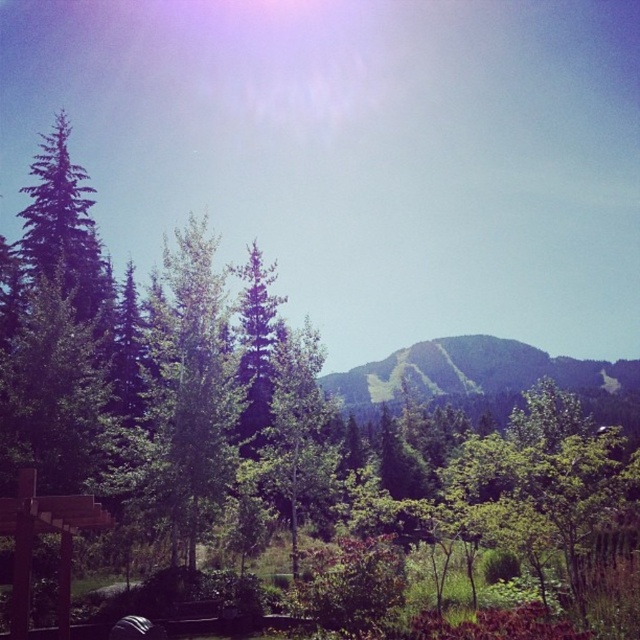
Does green leafy tree at center have a greater height compared to green grassy mountain at center?

Indeed, green leafy tree at center has a greater height compared to green grassy mountain at center.

Does green leafy tree at center have a smaller size compared to green grassy mountain at center?

Yes.

The height and width of the screenshot is (640, 640). I want to click on green leafy tree at center, so click(186, 396).

At what (x,y) coordinates should I click in order to perform the action: click on green leafy tree at center. Please return your answer as a coordinate pair (x, y). Looking at the image, I should click on (186, 396).